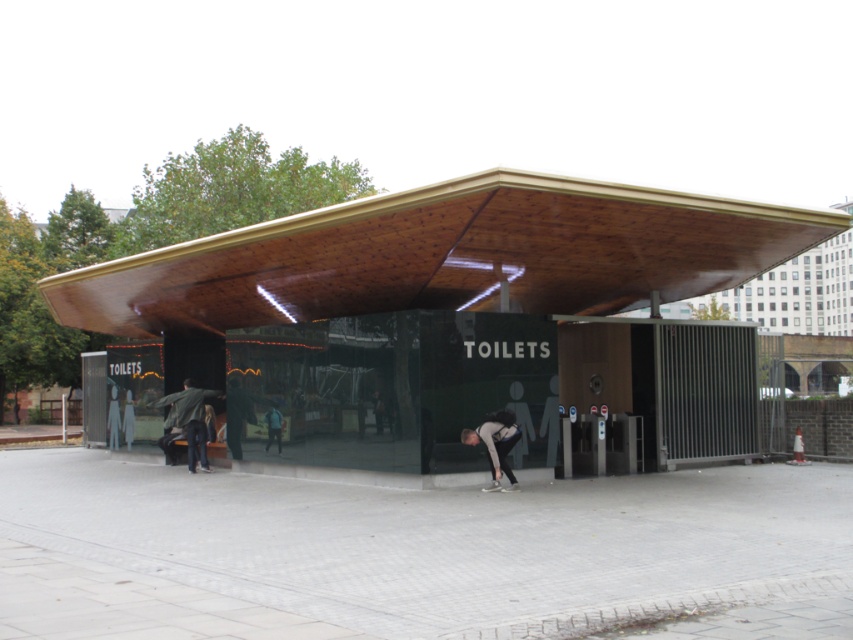
Question: Which point is closer to the camera?

Choices:
 (A) dark gray jacket at center
 (B) green fabric jacket at lower left
 (C) gray fabric skateboarder at lower center

Answer: (C)

Question: Can you confirm if wooden canopy at center is positioned to the left of green fabric jacket at lower left?

Choices:
 (A) yes
 (B) no

Answer: (B)

Question: Can you confirm if gray fabric skateboarder at lower center is bigger than green fabric jacket at lower left?

Choices:
 (A) no
 (B) yes

Answer: (A)

Question: Does green fabric jacket at lower left come behind blue shirt at lower center?

Choices:
 (A) yes
 (B) no

Answer: (A)

Question: Which point appears farthest from the camera in this image?

Choices:
 (A) (236, 428)
 (B) (494, 417)

Answer: (A)

Question: Which point is closer to the camera?

Choices:
 (A) click(227, 433)
 (B) click(202, 461)

Answer: (A)